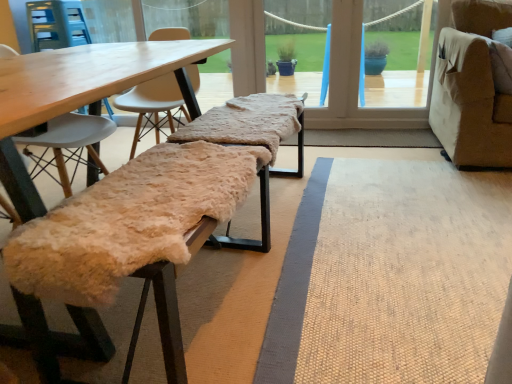
How much space does fuzzy woolen bench at center, acting as the second park bench starting from the bottom, occupy vertically?

The height of fuzzy woolen bench at center, acting as the second park bench starting from the bottom, is 9.20 inches.

Describe the element at coordinates (251, 125) in the screenshot. I see `fuzzy woolen bench at center, marked as the 1th park bench in a top-to-bottom arrangement` at that location.

At what (x,y) coordinates should I click in order to perform the action: click on fuzzy woolen bench at center, acting as the second park bench starting from the bottom. Please return your answer as a coordinate pair (x, y). Looking at the image, I should click on tap(251, 125).

This screenshot has width=512, height=384. In order to click on fuzzy beige bench at lower left, which is the 1th park bench from bottom to top in this screenshot , I will do `click(167, 316)`.

This screenshot has height=384, width=512. What do you see at coordinates (167, 316) in the screenshot? I see `fuzzy beige bench at lower left, which is the 1th park bench from bottom to top` at bounding box center [167, 316].

In the scene shown: Measure the distance between point (167,270) and camera.

The depth of point (167,270) is 88.60 centimeters.

The image size is (512, 384). Identify the location of fuzzy woolen bench at center, acting as the second park bench starting from the bottom. (251, 125).

Does fuzzy beige bench at lower left, arranged as the 2th park bench when viewed from the top, appear on the right side of fuzzy woolen bench at center, marked as the 1th park bench in a top-to-bottom arrangement?

Incorrect, fuzzy beige bench at lower left, arranged as the 2th park bench when viewed from the top, is not on the right side of fuzzy woolen bench at center, marked as the 1th park bench in a top-to-bottom arrangement.

Relative to fuzzy woolen bench at center, acting as the second park bench starting from the bottom, is fuzzy beige bench at lower left, which is the 1th park bench from bottom to top, in front or behind?

Visually, fuzzy beige bench at lower left, which is the 1th park bench from bottom to top, is located in front of fuzzy woolen bench at center, acting as the second park bench starting from the bottom.

Considering the points (79, 293) and (287, 102), which point is behind, point (79, 293) or point (287, 102)?

The point (287, 102) is farther from the camera.

From the image's perspective, does fuzzy beige bench at lower left, which is the 1th park bench from bottom to top, appear lower than fuzzy woolen bench at center, marked as the 1th park bench in a top-to-bottom arrangement?

Indeed, from the image's perspective, fuzzy beige bench at lower left, which is the 1th park bench from bottom to top, is shown beneath fuzzy woolen bench at center, marked as the 1th park bench in a top-to-bottom arrangement.

From a real-world perspective, is fuzzy beige bench at lower left, arranged as the 2th park bench when viewed from the top, located beneath fuzzy woolen bench at center, marked as the 1th park bench in a top-to-bottom arrangement?

Yes, from a real-world perspective, fuzzy beige bench at lower left, arranged as the 2th park bench when viewed from the top, is beneath fuzzy woolen bench at center, marked as the 1th park bench in a top-to-bottom arrangement.

Is fuzzy beige bench at lower left, which is the 1th park bench from bottom to top, wider or thinner than fuzzy woolen bench at center, marked as the 1th park bench in a top-to-bottom arrangement?

Considering their sizes, fuzzy beige bench at lower left, which is the 1th park bench from bottom to top, looks slimmer than fuzzy woolen bench at center, marked as the 1th park bench in a top-to-bottom arrangement.

From their relative heights in the image, would you say fuzzy beige bench at lower left, which is the 1th park bench from bottom to top, is taller or shorter than fuzzy woolen bench at center, marked as the 1th park bench in a top-to-bottom arrangement?

fuzzy beige bench at lower left, which is the 1th park bench from bottom to top, is taller than fuzzy woolen bench at center, marked as the 1th park bench in a top-to-bottom arrangement.

Which of these two, fuzzy beige bench at lower left, arranged as the 2th park bench when viewed from the top, or fuzzy woolen bench at center, marked as the 1th park bench in a top-to-bottom arrangement, is bigger?

With larger size is fuzzy beige bench at lower left, arranged as the 2th park bench when viewed from the top.

Would you say fuzzy beige bench at lower left, which is the 1th park bench from bottom to top, contains fuzzy woolen bench at center, acting as the second park bench starting from the bottom?

No, fuzzy beige bench at lower left, which is the 1th park bench from bottom to top, does not contain fuzzy woolen bench at center, acting as the second park bench starting from the bottom.

Is fuzzy beige bench at lower left, arranged as the 2th park bench when viewed from the top, directly adjacent to fuzzy woolen bench at center, marked as the 1th park bench in a top-to-bottom arrangement?

fuzzy beige bench at lower left, arranged as the 2th park bench when viewed from the top, and fuzzy woolen bench at center, marked as the 1th park bench in a top-to-bottom arrangement, are clearly separated.

Is fuzzy beige bench at lower left, arranged as the 2th park bench when viewed from the top, aimed at fuzzy woolen bench at center, marked as the 1th park bench in a top-to-bottom arrangement?

No, fuzzy beige bench at lower left, arranged as the 2th park bench when viewed from the top, is not facing towards fuzzy woolen bench at center, marked as the 1th park bench in a top-to-bottom arrangement.

What's the angular difference between fuzzy beige bench at lower left, which is the 1th park bench from bottom to top, and fuzzy woolen bench at center, marked as the 1th park bench in a top-to-bottom arrangement,'s facing directions?

1.4 degrees.

I want to click on park bench located on the right of fuzzy beige bench at lower left, arranged as the 2th park bench when viewed from the top, so click(x=251, y=125).

Between fuzzy woolen bench at center, acting as the second park bench starting from the bottom, and fuzzy beige bench at lower left, which is the 1th park bench from bottom to top, which one appears on the left side from the viewer's perspective?

Positioned to the left is fuzzy beige bench at lower left, which is the 1th park bench from bottom to top.

Is fuzzy woolen bench at center, acting as the second park bench starting from the bottom, behind fuzzy beige bench at lower left, which is the 1th park bench from bottom to top?

Yes, the depth of fuzzy woolen bench at center, acting as the second park bench starting from the bottom, is greater than that of fuzzy beige bench at lower left, which is the 1th park bench from bottom to top.

Is point (250, 100) in front of point (154, 272)?

That is False.

From the image's perspective, which one is positioned lower, fuzzy woolen bench at center, marked as the 1th park bench in a top-to-bottom arrangement, or fuzzy beige bench at lower left, arranged as the 2th park bench when viewed from the top?

fuzzy beige bench at lower left, arranged as the 2th park bench when viewed from the top, appears lower in the image.

Looking at this image, from a real-world perspective, which is physically above, fuzzy woolen bench at center, marked as the 1th park bench in a top-to-bottom arrangement, or fuzzy beige bench at lower left, arranged as the 2th park bench when viewed from the top?

fuzzy woolen bench at center, marked as the 1th park bench in a top-to-bottom arrangement.

Which of these two, fuzzy woolen bench at center, acting as the second park bench starting from the bottom, or fuzzy beige bench at lower left, arranged as the 2th park bench when viewed from the top, is thinner?

fuzzy beige bench at lower left, arranged as the 2th park bench when viewed from the top.

Is fuzzy woolen bench at center, marked as the 1th park bench in a top-to-bottom arrangement, shorter than fuzzy beige bench at lower left, arranged as the 2th park bench when viewed from the top?

Correct, fuzzy woolen bench at center, marked as the 1th park bench in a top-to-bottom arrangement, is not as tall as fuzzy beige bench at lower left, arranged as the 2th park bench when viewed from the top.

Looking at this image, based on their sizes in the image, would you say fuzzy woolen bench at center, acting as the second park bench starting from the bottom, is bigger or smaller than fuzzy beige bench at lower left, arranged as the 2th park bench when viewed from the top?

fuzzy woolen bench at center, acting as the second park bench starting from the bottom, is smaller than fuzzy beige bench at lower left, arranged as the 2th park bench when viewed from the top.

Is fuzzy woolen bench at center, acting as the second park bench starting from the bottom, surrounding fuzzy beige bench at lower left, arranged as the 2th park bench when viewed from the top?

No, fuzzy beige bench at lower left, arranged as the 2th park bench when viewed from the top, is not a part of fuzzy woolen bench at center, acting as the second park bench starting from the bottom.

Are fuzzy woolen bench at center, acting as the second park bench starting from the bottom, and fuzzy beige bench at lower left, which is the 1th park bench from bottom to top, making contact?

fuzzy woolen bench at center, acting as the second park bench starting from the bottom, and fuzzy beige bench at lower left, which is the 1th park bench from bottom to top, are not in contact.

Does fuzzy woolen bench at center, marked as the 1th park bench in a top-to-bottom arrangement, turn towards fuzzy beige bench at lower left, arranged as the 2th park bench when viewed from the top?

No, fuzzy woolen bench at center, marked as the 1th park bench in a top-to-bottom arrangement, is not turned towards fuzzy beige bench at lower left, arranged as the 2th park bench when viewed from the top.

How many degrees apart are the facing directions of fuzzy woolen bench at center, acting as the second park bench starting from the bottom, and fuzzy beige bench at lower left, arranged as the 2th park bench when viewed from the top?

The facing directions of fuzzy woolen bench at center, acting as the second park bench starting from the bottom, and fuzzy beige bench at lower left, arranged as the 2th park bench when viewed from the top, are 1.4 degrees apart.

The image size is (512, 384). I want to click on park bench directly beneath the fuzzy woolen bench at center, acting as the second park bench starting from the bottom (from a real-world perspective), so click(167, 316).

Locate an element on the screen. Image resolution: width=512 pixels, height=384 pixels. park bench in front of the fuzzy woolen bench at center, marked as the 1th park bench in a top-to-bottom arrangement is located at coordinates (167, 316).

Where is `park bench on the right of fuzzy beige bench at lower left, which is the 1th park bench from bottom to top`? The width and height of the screenshot is (512, 384). park bench on the right of fuzzy beige bench at lower left, which is the 1th park bench from bottom to top is located at coordinates (251, 125).